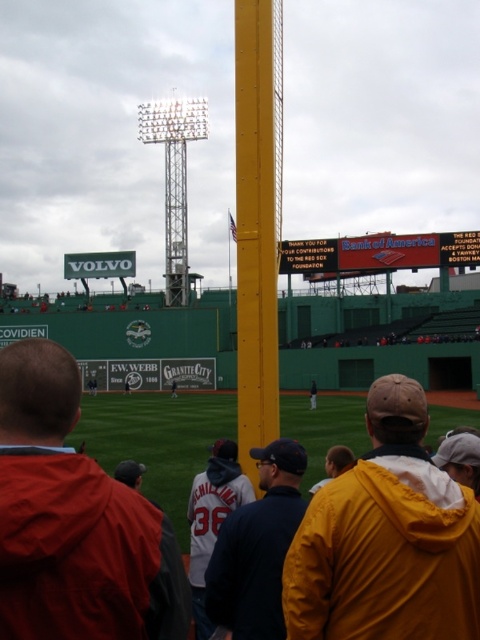
Question: Which point appears closest to the camera in this image?

Choices:
 (A) (44, 412)
 (B) (240, 429)
 (C) (295, 621)

Answer: (A)

Question: Is orange hooded jacket at lower left to the left of yellow painted metal pole at center from the viewer's perspective?

Choices:
 (A) yes
 (B) no

Answer: (A)

Question: Can you confirm if orange hooded jacket at lower left is positioned to the right of red plastic scoreboard at center?

Choices:
 (A) no
 (B) yes

Answer: (A)

Question: Which object appears farthest from the camera in this image?

Choices:
 (A) yellow painted metal pole at center
 (B) red plastic scoreboard at center
 (C) orange hooded jacket at lower left

Answer: (B)

Question: Does orange hooded jacket at lower left have a lesser width compared to red plastic scoreboard at center?

Choices:
 (A) yes
 (B) no

Answer: (A)

Question: Which point appears farthest from the camera in this image?

Choices:
 (A) (83, 516)
 (B) (396, 454)

Answer: (B)